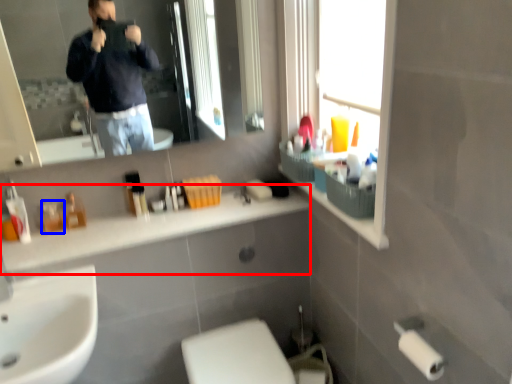
Question: Which object appears closest to the camera in this image, counter top (highlighted by a red box) or toiletry (highlighted by a blue box)?

Choices:
 (A) counter top
 (B) toiletry

Answer: (A)